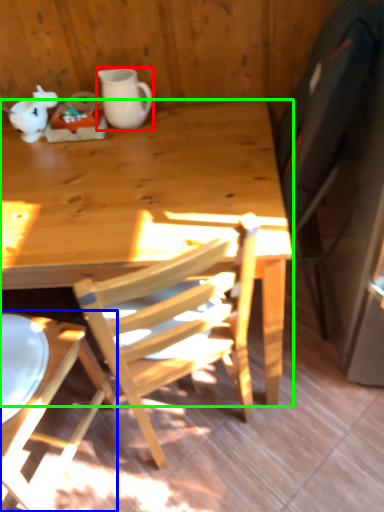
Question: Considering the real-world distances, which object is farthest from coffee cup (highlighted by a red box)? chair (highlighted by a blue box) or desk (highlighted by a green box)?

Choices:
 (A) chair
 (B) desk

Answer: (A)